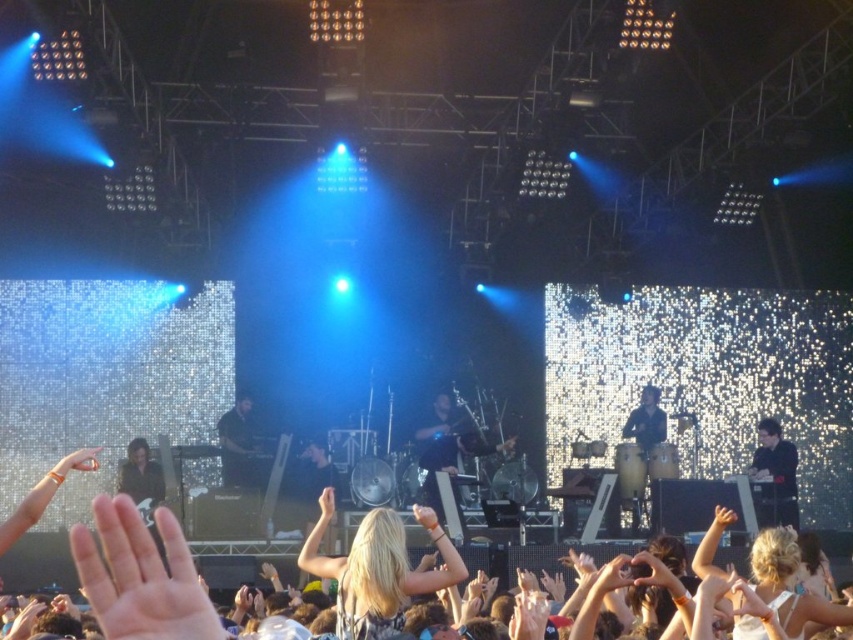
Question: Is blonde hair at center closer to camera compared to smooth skin hand at center?

Choices:
 (A) no
 (B) yes

Answer: (A)

Question: Is the position of smooth skin hand at center more distant than that of smooth skin hand at upper center?

Choices:
 (A) yes
 (B) no

Answer: (B)

Question: Estimate the real-world distances between objects in this image. Which object is farther from the blonde hair at center?

Choices:
 (A) matte black hand at center
 (B) light brown leather hand at center
 (C) matte black hand at lower center
 (D) black matte shirt at center

Answer: (A)

Question: Based on their relative distances, which object is nearer to the blonde hair at center?

Choices:
 (A) smooth white hand at center
 (B) black leather jacket at lower right
 (C) matte black hand at center

Answer: (A)

Question: Where is smooth skin hand at center located in relation to matte skin hand at lower left in the image?

Choices:
 (A) left
 (B) right

Answer: (B)

Question: Among these points, which one is nearest to the camera?

Choices:
 (A) (386, 620)
 (B) (508, 449)
 (C) (751, 612)
 (D) (648, 582)

Answer: (C)